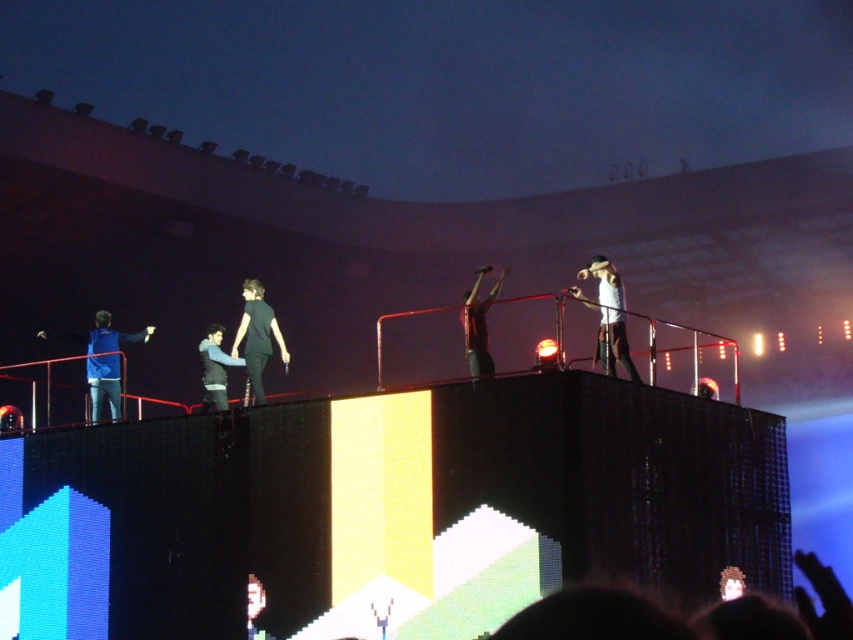
In the scene shown: Is white matte shirt at upper right below shiny gold hair at center?

No, white matte shirt at upper right is not below shiny gold hair at center.

The image size is (853, 640). Identify the location of white matte shirt at upper right. (608, 316).

Where is `white matte shirt at upper right`? The image size is (853, 640). white matte shirt at upper right is located at coordinates (608, 316).

Can you confirm if white matte shirt at upper right is bigger than red matte shirt at center?

Yes.

Which is behind, point (606, 328) or point (473, 330)?

The point (473, 330) is behind.

Where is `white matte shirt at upper right`? The height and width of the screenshot is (640, 853). white matte shirt at upper right is located at coordinates (608, 316).

Who is more distant from viewer, (595, 358) or (207, 390)?

The point (207, 390) is behind.

Which is more to the left, white matte shirt at upper right or black leather jacket at center?

From the viewer's perspective, black leather jacket at center appears more on the left side.

Which is in front, point (608, 362) or point (213, 323)?

Point (608, 362)

The width and height of the screenshot is (853, 640). I want to click on white matte shirt at upper right, so click(x=608, y=316).